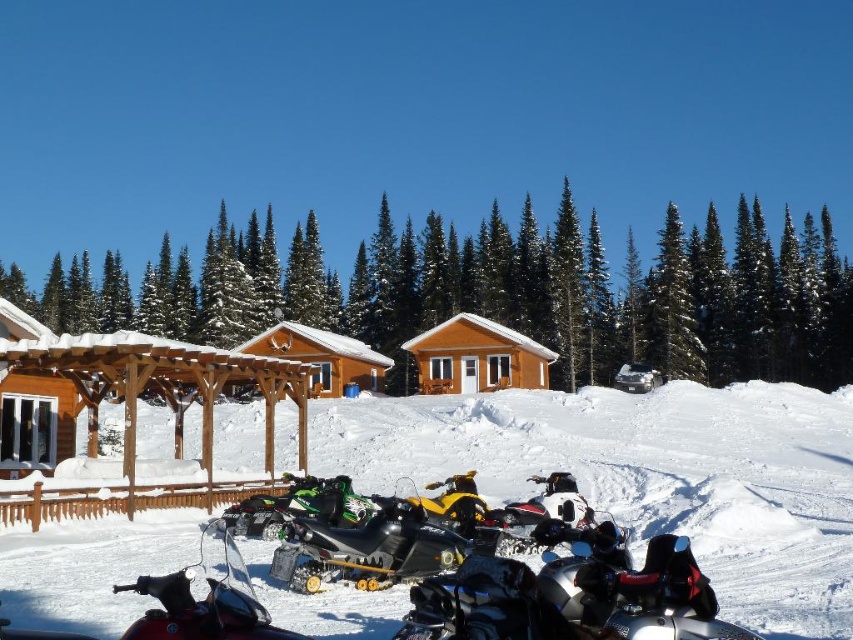
Is matte black snowmobile at lower center to the right of brown wooden cabin at center from the viewer's perspective?

Indeed, matte black snowmobile at lower center is positioned on the right side of brown wooden cabin at center.

Which is in front, point (167, 573) or point (314, 369)?

Positioned in front is point (167, 573).

Between point (207, 552) and point (328, 378), which one is positioned behind?

Positioned behind is point (328, 378).

Locate an element on the screen. matte black snowmobile at lower center is located at coordinates (206, 598).

Does shiny silver snowmobile at lower center appear over brown wooden cabin at center?

Indeed, shiny silver snowmobile at lower center is positioned over brown wooden cabin at center.

Where is `shiny silver snowmobile at lower center`? The height and width of the screenshot is (640, 853). shiny silver snowmobile at lower center is located at coordinates (572, 600).

Who is more distant from viewer, (602, 579) or (323, 387)?

The point (323, 387) is more distant.

Where is `shiny silver snowmobile at lower center`? This screenshot has width=853, height=640. shiny silver snowmobile at lower center is located at coordinates (572, 600).

Does point (281, 604) lie behind point (340, 346)?

That is False.

Find the location of `wooden ski slope at center`. wooden ski slope at center is located at coordinates (648, 476).

Locate an element on the screen. The height and width of the screenshot is (640, 853). wooden ski slope at center is located at coordinates (648, 476).